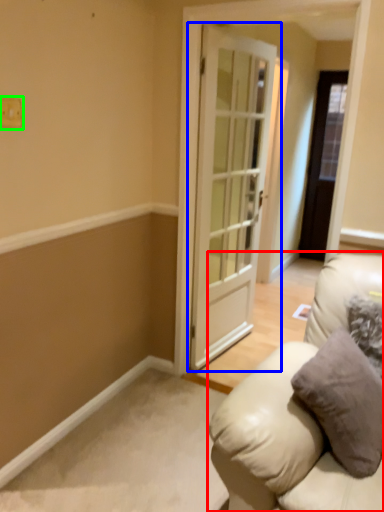
Question: Which is farther away from studio couch (highlighted by a red box)? door (highlighted by a blue box) or light switch (highlighted by a green box)?

Choices:
 (A) door
 (B) light switch

Answer: (B)